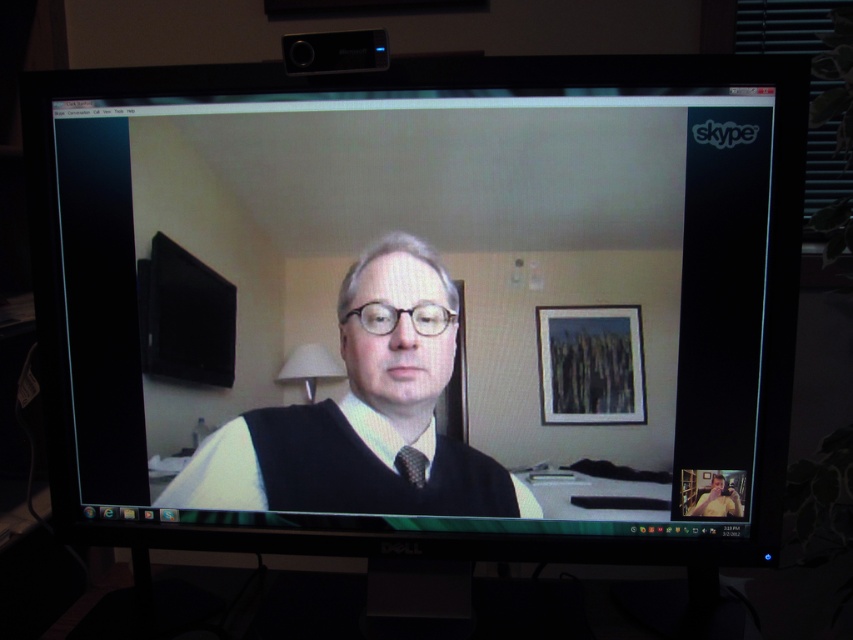
You are looking at a Skype video call on a computer monitor. You see a person wearing a matte black sweater at center and a black textured tie at center. Which clothing item is higher up on their body?

The matte black sweater at center is above the black textured tie at center, so the sweater is higher up on their body.

You are trying to determine the spatial relationship between two points on the screen. The first point is labeled as point (x=415, y=502) and the second is point (x=410, y=454). Based on the scene description provided, which point is positioned further back in the depth of the image?

Point (x=415, y=502) is positioned further back in the depth of the image compared to point (x=410, y=454), as stated in the objects description.

Looking at this image, looking at the Skype video call on the computer monitor, you notice two clothing items worn by the main participant. Which clothing item, the matte black sweater at center or the black textured tie at center, appears larger in height?

The matte black sweater at center is much taller than the black textured tie at center.